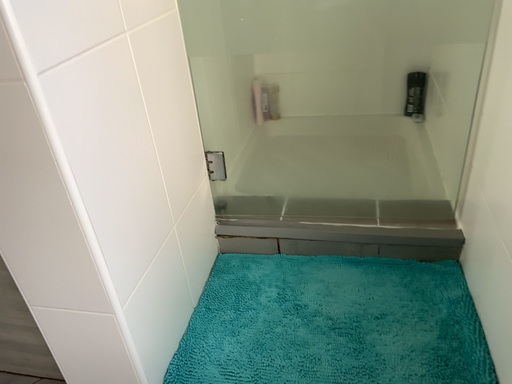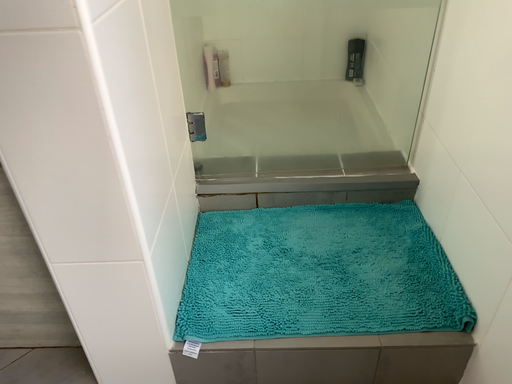
Question: Which way did the camera rotate in the video?

Choices:
 (A) rotated right
 (B) rotated left

Answer: (A)